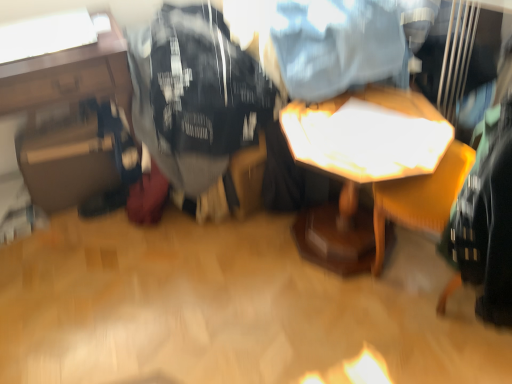
Question: Is black cotton t-shirt at center wider than matte black suitcase at left, which is the 1th table in left-to-right order?

Choices:
 (A) yes
 (B) no

Answer: (A)

Question: Is matte black suitcase at left, placed as the 2th table when sorted from right to left, at the back of black cotton t-shirt at center?

Choices:
 (A) no
 (B) yes

Answer: (A)

Question: Are black cotton t-shirt at center and matte black suitcase at left, which is the 1th table in left-to-right order, far apart?

Choices:
 (A) yes
 (B) no

Answer: (B)

Question: From a real-world perspective, is black cotton t-shirt at center on top of matte black suitcase at left, placed as the 2th table when sorted from right to left?

Choices:
 (A) no
 (B) yes

Answer: (B)

Question: Is black cotton t-shirt at center completely or partially outside of matte black suitcase at left, placed as the 2th table when sorted from right to left?

Choices:
 (A) no
 (B) yes

Answer: (B)

Question: From a real-world perspective, is black cotton t-shirt at center beneath matte black suitcase at left, placed as the 2th table when sorted from right to left?

Choices:
 (A) no
 (B) yes

Answer: (A)

Question: From the image's perspective, does matte black suitcase at left, which is the 1th table in left-to-right order, appear higher than black cotton t-shirt at center?

Choices:
 (A) no
 (B) yes

Answer: (A)

Question: From a real-world perspective, is matte black suitcase at left, placed as the 2th table when sorted from right to left, beneath black cotton t-shirt at center?

Choices:
 (A) yes
 (B) no

Answer: (A)

Question: Is matte black suitcase at left, placed as the 2th table when sorted from right to left, taller than black cotton t-shirt at center?

Choices:
 (A) no
 (B) yes

Answer: (B)

Question: Is matte black suitcase at left, which is the 1th table in left-to-right order, shorter than black cotton t-shirt at center?

Choices:
 (A) yes
 (B) no

Answer: (B)

Question: From the image's perspective, would you say matte black suitcase at left, placed as the 2th table when sorted from right to left, is shown under black cotton t-shirt at center?

Choices:
 (A) no
 (B) yes

Answer: (B)

Question: Is the position of matte black suitcase at left, which is the 1th table in left-to-right order, less distant than that of black cotton t-shirt at center?

Choices:
 (A) yes
 (B) no

Answer: (B)

Question: Does black cotton t-shirt at center have a greater width compared to wooden table at center, the second table in the left-to-right sequence?

Choices:
 (A) yes
 (B) no

Answer: (A)